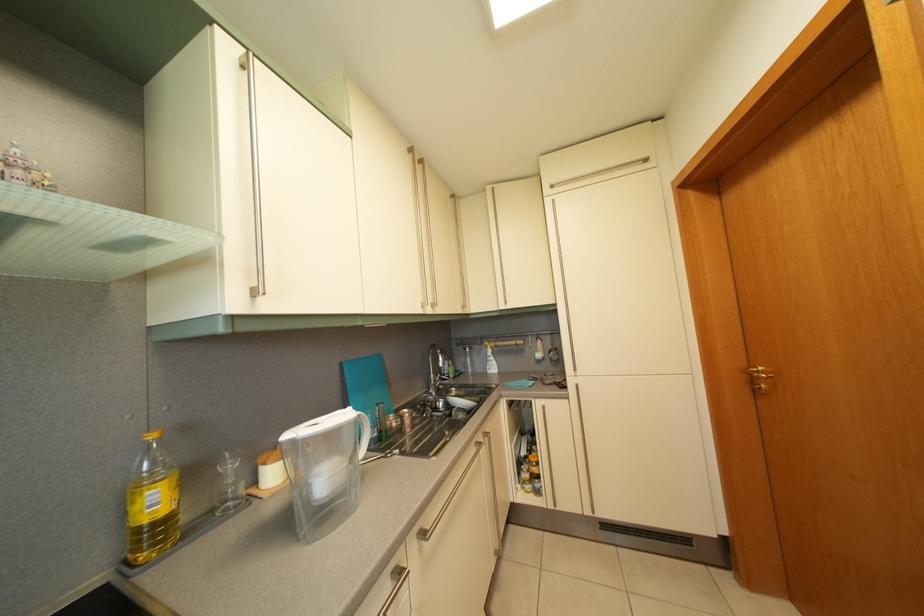
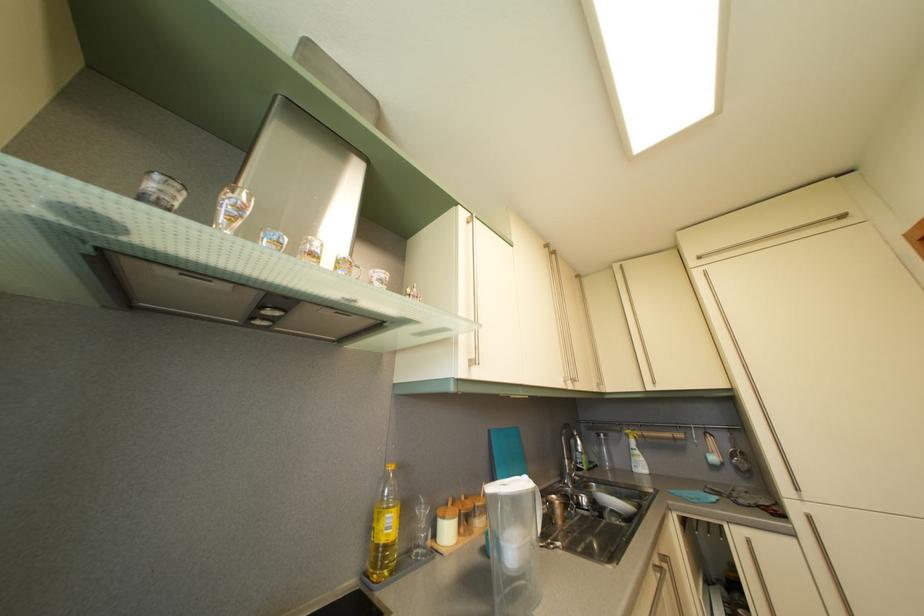
Find the pixel in the second image that matches point (164, 509) in the first image.

(396, 533)